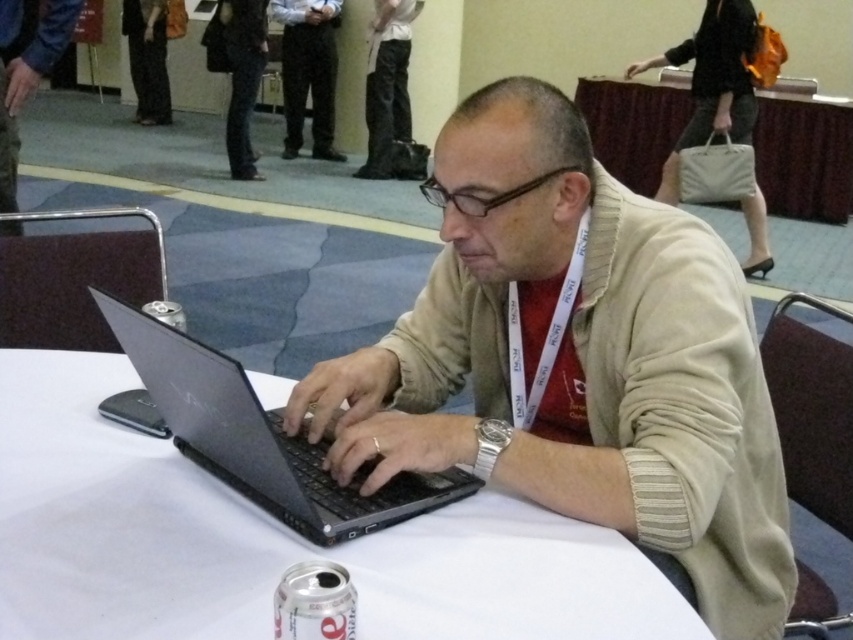
You are a photographer taking a picture of the white cloth table at center and the slate gray matte laptop at center. Which object will appear larger in your photo?

The white cloth table at center will appear larger in the photo because it is closer to the viewer than the slate gray matte laptop at center.

You are a photographer trying to capture a clear shot of the matte black laptop at center and the white cloth table at center. Since you want the laptop to be the main focus, which object should you position closer to the camera?

The matte black laptop at center should be positioned closer to the camera because it has a greater height compared to the white cloth table at center, making it naturally stand out as the main focus.

In the scene shown: You are a delivery person who needs to place a small package on the table without moving the laptop. The package requires 5 inches of space. Can you fit it between the white cloth table at center and the slate gray matte laptop at center?

The distance between the white cloth table at center and the slate gray matte laptop at center is 4.79 inches, which is less than the required 5 inches. Therefore, the package cannot be placed there without moving the laptop.